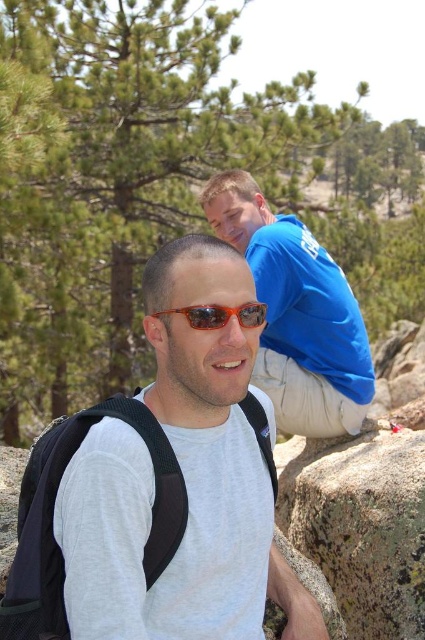
Question: Estimate the real-world distances between objects in this image. Which object is farther from the green textured pine tree at upper center?

Choices:
 (A) gray matte t-shirt at center
 (B) orange reflective sunglasses at center
 (C) blue cotton shirt at upper center
 (D) black mesh backpack at center

Answer: (B)

Question: Is black mesh backpack at center bigger than orange reflective sunglasses at center?

Choices:
 (A) yes
 (B) no

Answer: (A)

Question: Which point is farther to the camera?

Choices:
 (A) blue cotton shirt at upper center
 (B) orange reflective sunglasses at center
 (C) black mesh backpack at center

Answer: (A)

Question: Is green textured pine tree at upper center below black mesh backpack at center?

Choices:
 (A) no
 (B) yes

Answer: (A)

Question: Which object appears farthest from the camera in this image?

Choices:
 (A) orange reflective sunglasses at center
 (B) gray matte t-shirt at center
 (C) blue cotton shirt at upper center
 (D) black mesh backpack at center

Answer: (C)

Question: Does green textured pine tree at upper center have a greater width compared to orange reflective sunglasses at center?

Choices:
 (A) yes
 (B) no

Answer: (A)